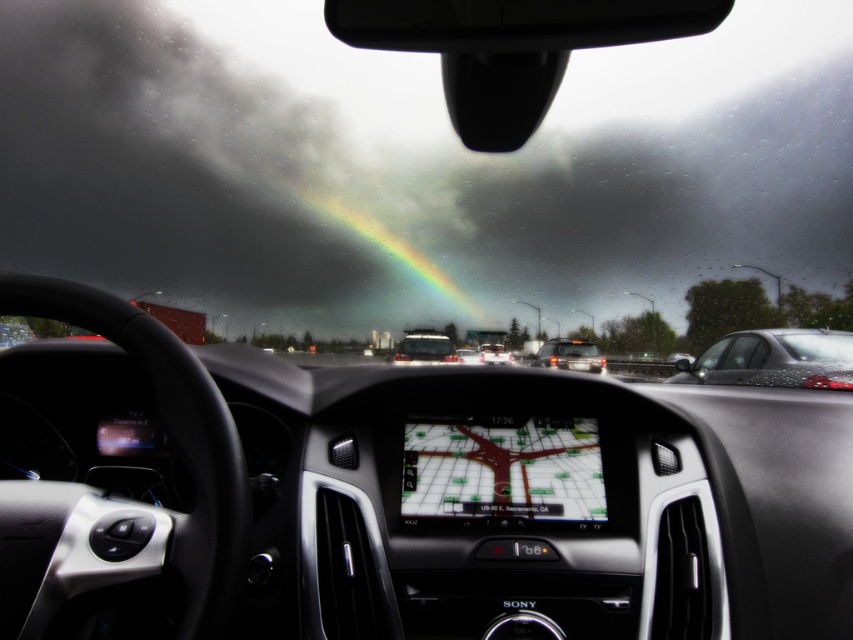
You are a passenger in the car and looking out the window. You see the shiny black sedan at right and the matte black bus at center. Which vehicle is taller?

The shiny black sedan at right is much taller than the matte black bus at center.

You are driving a car and see the satin silver sedan at center on the highway. The navigation screen shows your current position as point [569,355]. Is the satin silver sedan at center in front of or behind your current position?

The satin silver sedan at center is located at point [569,355], which matches your current position, so it is neither in front nor behind your current position.